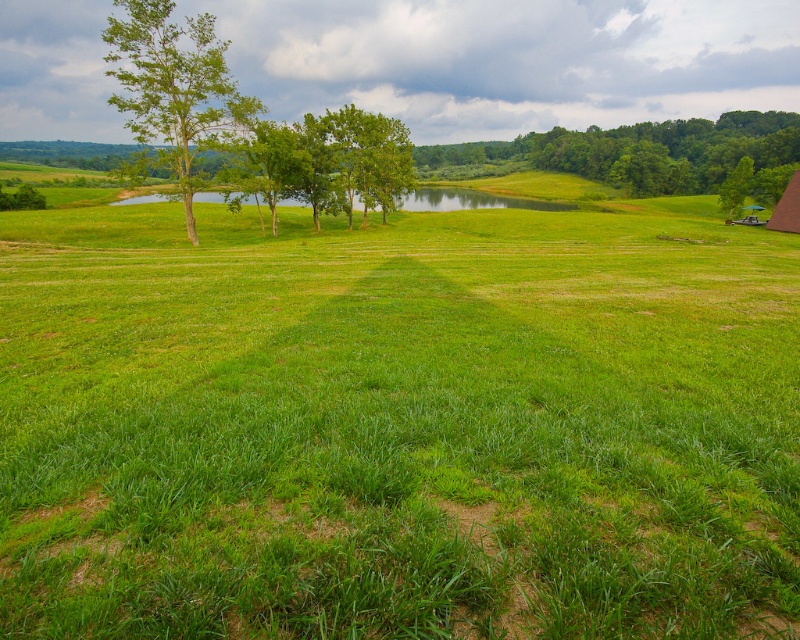
Question: Can you confirm if green leafy tree at center is positioned above green leafy trees at center?

Choices:
 (A) no
 (B) yes

Answer: (B)

Question: Which of these objects is positioned farthest from the green leafy tree at upper right?

Choices:
 (A) green canvas tent at right
 (B) green grassy field at center
 (C) green leafy tree at center

Answer: (C)

Question: Which object is positioned closest to the green leafy tree at center?

Choices:
 (A) green grassy field at center
 (B) green canvas tent at right
 (C) green leafy tree at upper right
 (D) green leafy trees at center

Answer: (C)

Question: Does green grassy field at center appear on the left side of green leafy trees at center?

Choices:
 (A) no
 (B) yes

Answer: (B)

Question: In this image, where is green leafy tree at center located relative to green leafy tree at left?

Choices:
 (A) left
 (B) right

Answer: (B)

Question: Which point is farther from the camera taking this photo?

Choices:
 (A) (174, 320)
 (B) (736, 179)
 (C) (122, 56)

Answer: (B)